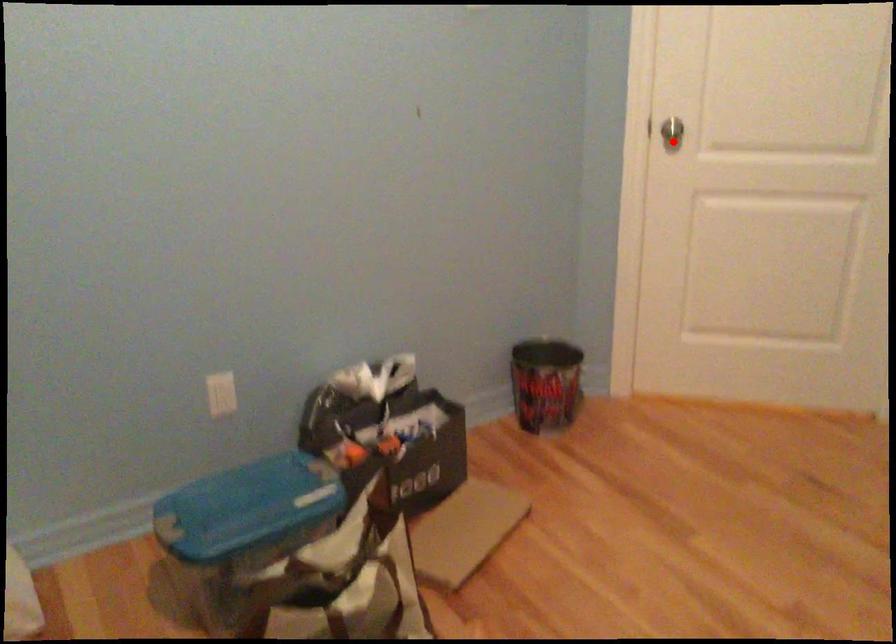
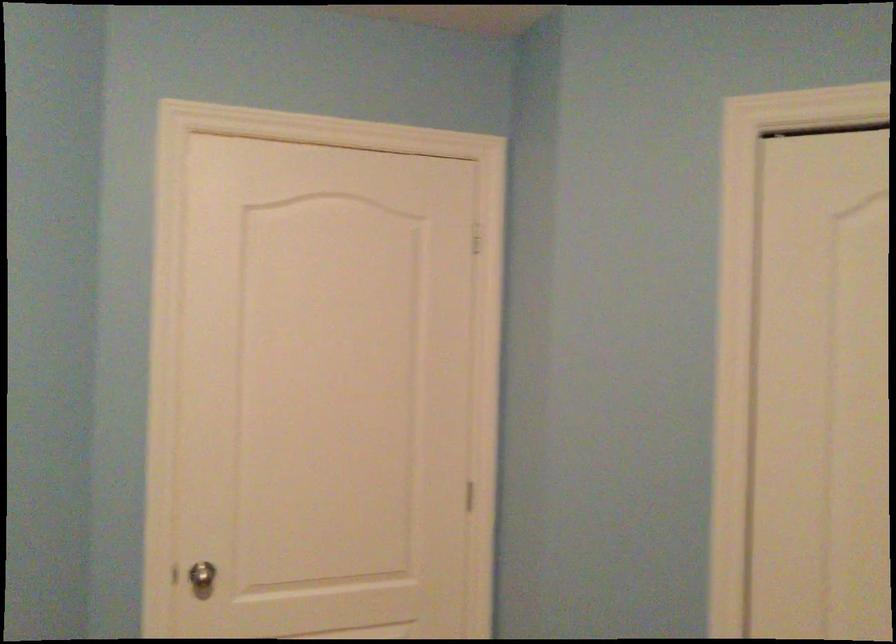
Find the pixel in the second image that matches the highlighted location in the first image.

(202, 578)